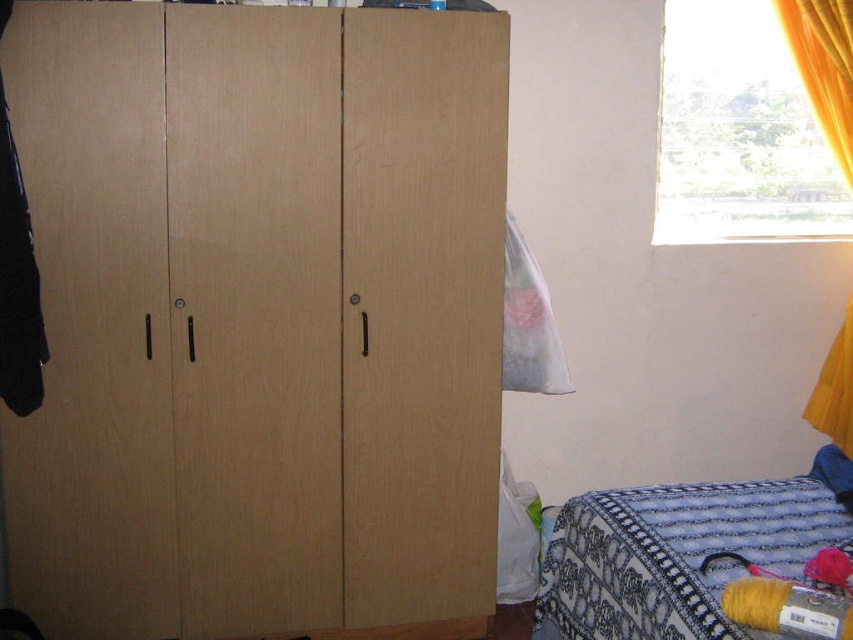
You are trying to reach the translucent plastic bag at upper right to grab your keys. However, the blue knitted blanket at lower right is in the way. Can you move the blanket to access the bag?

The blue knitted blanket at lower right is closer to the viewer than the translucent plastic bag at upper right, so you can move the blanket to access the bag.

From the picture: You are trying to determine which object is taller between the yellow fabric curtain at upper right and the translucent plastic bag at upper right in the room. Based on the scene description, which one is taller?

The yellow fabric curtain at upper right is taller than the translucent plastic bag at upper right according to the description.

You are organizing items in the room and need to place a new item between the blue knitted blanket at lower right and the translucent plastic bag at upper right. Based on their positions, where should you place the new item?

The blue knitted blanket at lower right is to the right of the translucent plastic bag at upper right, so you should place the new item between them by positioning it to the left of the blue knitted blanket at lower right and to the right of the translucent plastic bag at upper right.